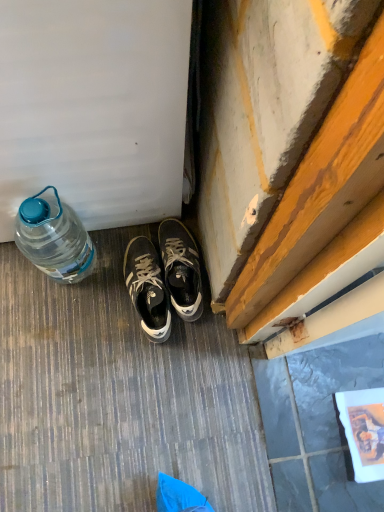
Question: Based on their sizes in the image, would you say translucent plastic bottle at left is bigger or smaller than matte black sneakers at center, positioned as the second sneakers in left-to-right order?

Choices:
 (A) big
 (B) small

Answer: (A)

Question: Considering the positions of translucent plastic bottle at left and matte black sneakers at center, positioned as the second sneakers in left-to-right order, in the image, is translucent plastic bottle at left wider or thinner than matte black sneakers at center, positioned as the second sneakers in left-to-right order,?

Choices:
 (A) wide
 (B) thin

Answer: (B)

Question: Which is farther from the translucent plastic bottle at left?

Choices:
 (A) dark gray leather sneakers at center, which appears as the 1th sneakers when viewed from the left
 (B) matte black sneakers at center, positioned as the second sneakers in left-to-right order

Answer: (B)

Question: Which object is the farthest from the dark gray leather sneakers at center, the 2th sneakers when ordered from right to left?

Choices:
 (A) translucent plastic bottle at left
 (B) matte black sneakers at center, the first sneakers when ordered from right to left

Answer: (A)